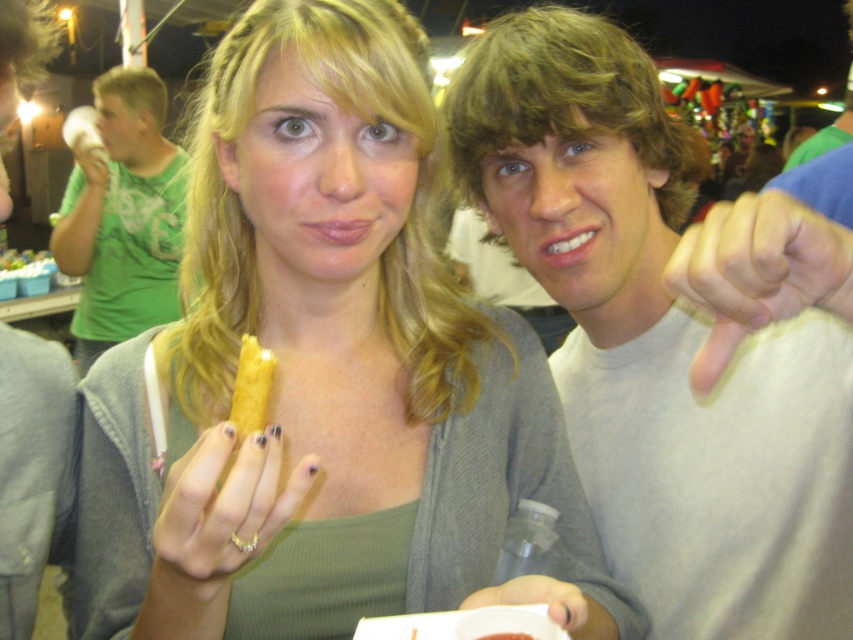
Is point (16, 620) positioned in front of point (500, 598)?

No, it is behind (500, 598).

Does green matte shirt at upper left have a larger size compared to white matte plastic cup at lower center?

Yes, green matte shirt at upper left is bigger than white matte plastic cup at lower center.

Describe the element at coordinates (32, 467) in the screenshot. I see `green matte shirt at upper left` at that location.

Image resolution: width=853 pixels, height=640 pixels. Find the location of `green matte shirt at upper left`. green matte shirt at upper left is located at coordinates (32, 467).

Looking at this image, does matte yellow snack at center appear on the left side of yellow matte corn dog at center?

Incorrect, matte yellow snack at center is not on the left side of yellow matte corn dog at center.

Who is more forward, (503, 460) or (39, 259)?

Point (503, 460) is more forward.

Does point (293, 426) lie in front of point (32, 259)?

That is True.

You are a GUI agent. You are given a task and a screenshot of the screen. Output one action in this format:
    pyautogui.click(x=<x>, y=<y>)
    Task: Click on the matte yellow snack at center
    The height and width of the screenshot is (640, 853).
    Given the screenshot: What is the action you would take?
    pyautogui.click(x=318, y=371)

Measure the distance from matte yellow snack at center to yellow matte breadstick at center.

matte yellow snack at center and yellow matte breadstick at center are 6.38 inches apart from each other.

Is point (294, 592) in front of point (244, 420)?

That is False.

Which is in front, point (91, 545) or point (250, 412)?

Positioned in front is point (250, 412).

The image size is (853, 640). What are the coordinates of `matte yellow snack at center` in the screenshot? It's located at (318, 371).